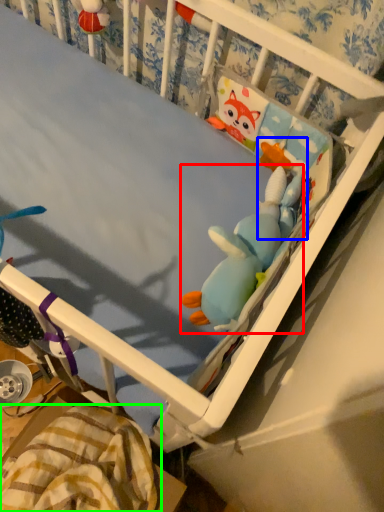
Question: Estimate the real-world distances between objects in this image. Which object is closer to toy (highlighted by a red box), toy (highlighted by a blue box) or blanket (highlighted by a green box)?

Choices:
 (A) toy
 (B) blanket

Answer: (A)